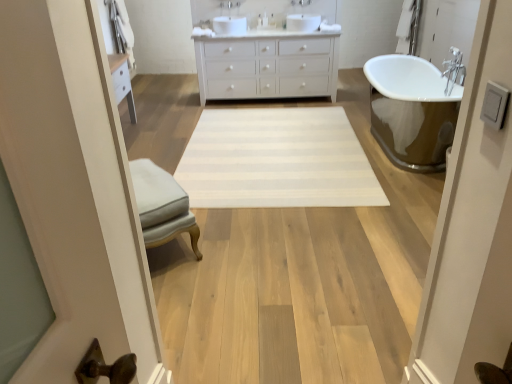
Question: Would you say white matte cabinet at center is inside or outside white striped rug at center?

Choices:
 (A) outside
 (B) inside

Answer: (A)

Question: Based on their sizes in the image, would you say white matte cabinet at center is bigger or smaller than white striped rug at center?

Choices:
 (A) small
 (B) big

Answer: (B)

Question: Considering the real-world distances, which object is farthest from the light gray fabric ottoman at center?

Choices:
 (A) white striped rug at center
 (B) white matte cabinet at center

Answer: (B)

Question: Which of these objects is positioned closest to the white striped rug at center?

Choices:
 (A) white matte cabinet at center
 (B) light gray fabric ottoman at center

Answer: (B)